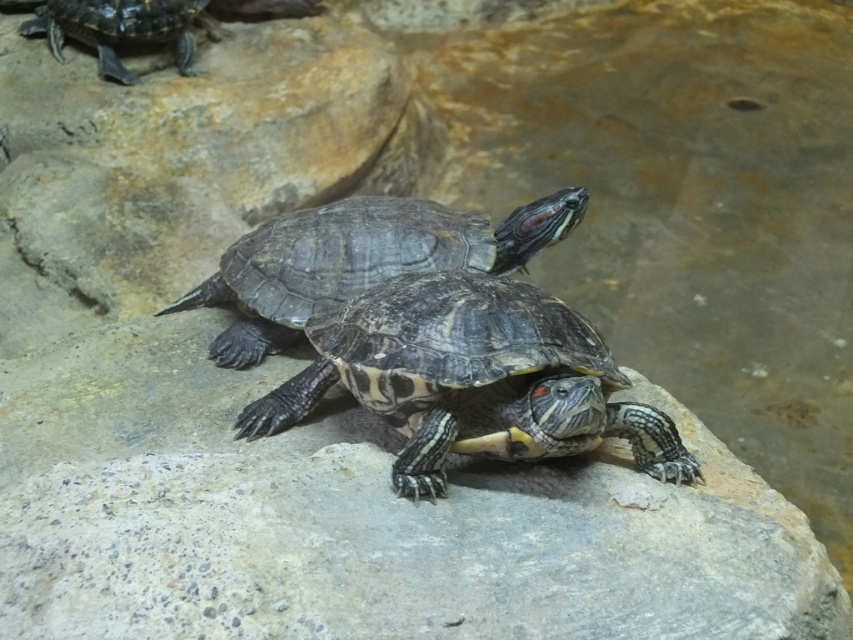
You are a zookeeper observing two turtles in their enclosure. You notice two specific points marked in the image. The first point is at coordinates point [515,300] and the second is at point [223,269]. If you were to walk from the first point to the second, would you be moving towards the turtles or away from them?

The point [515,300] is in front of point [223,269]. Therefore, moving from the first point to the second would mean moving away from the turtles since the first point is closer to them.

You are a zookeeper tasked with preparing a feeding area for the two tortoises. The feeding area has a width of 1 meter. If you need to place both the shiny dark brown tortoise at center and the shiny black tortoise at upper left in the area without overlapping, will there be enough space?

The shiny dark brown tortoise at center is wider than the shiny black tortoise at upper left. Since the feeding area is 1 meter wide, and the total width of both tortoises combined would be more than 1 meter if the dark brown one is already wider than the black one, there might not be enough space. However, without exact measurements, it is uncertain. The zookeeper should measure both tortoises to confirm.